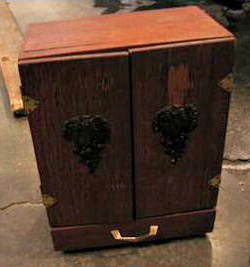
At what (x,y) coordinates should I click in order to perform the action: click on cabinet. Please return your answer as a coordinate pair (x, y). The image size is (250, 267). Looking at the image, I should click on (138, 151).